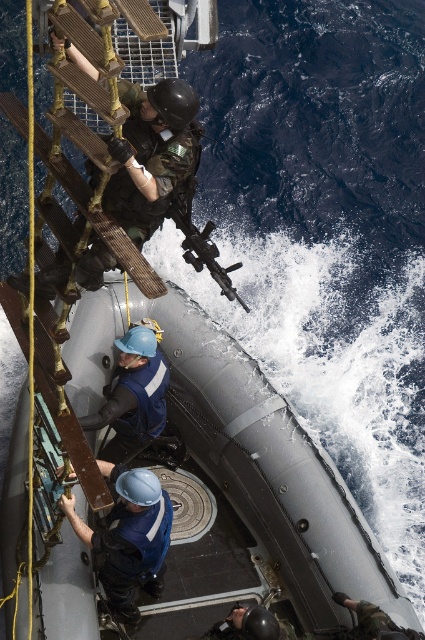
You are a safety inspector reviewing the boarding operation. You notice two protective headgear items in the scene. Which one is bigger in size between the blue hard hat at center and the shiny black helmet at lower center?

The blue hard hat at center is larger in size compared to the shiny black helmet at lower center.

You are a military advisor assessing the boarding operation. You notice the matte black rifle at center and the shiny black helmet at lower center. Which object occupies more horizontal space in the scene?

The matte black rifle at center is wider than the shiny black helmet at lower center, so it occupies more horizontal space in the scene.

You are a military observer assessing the boarding operation. You notice the blue hard hat at center and the matte black rifle at center. Which object is positioned lower in the scene?

The blue hard hat at center is located below the matte black rifle at center, so it is positioned lower in the scene.